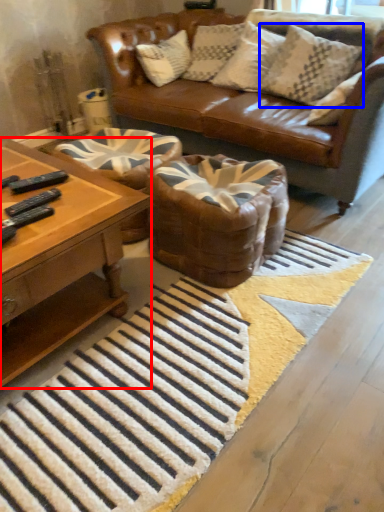
Question: Among these objects, which one is farthest to the camera, coffee table (highlighted by a red box) or pillow (highlighted by a blue box)?

Choices:
 (A) coffee table
 (B) pillow

Answer: (B)